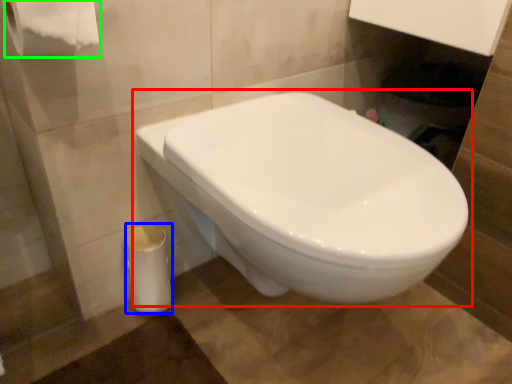
Question: Which object is the closest to the toilet (highlighted by a red box)? Choose among these: porcelain (highlighted by a blue box) or toilet paper (highlighted by a green box).

Choices:
 (A) porcelain
 (B) toilet paper

Answer: (A)